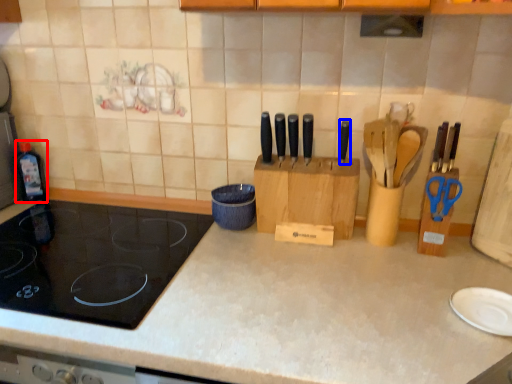
Question: Which object appears closest to the camera in this image, bottle (highlighted by a red box) or knife (highlighted by a blue box)?

Choices:
 (A) bottle
 (B) knife

Answer: (B)